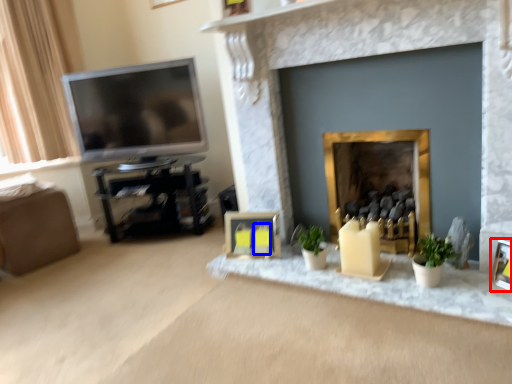
Question: Which object is further to the camera taking this photo, picture frame (highlighted by a red box) or candle (highlighted by a blue box)?

Choices:
 (A) picture frame
 (B) candle

Answer: (B)